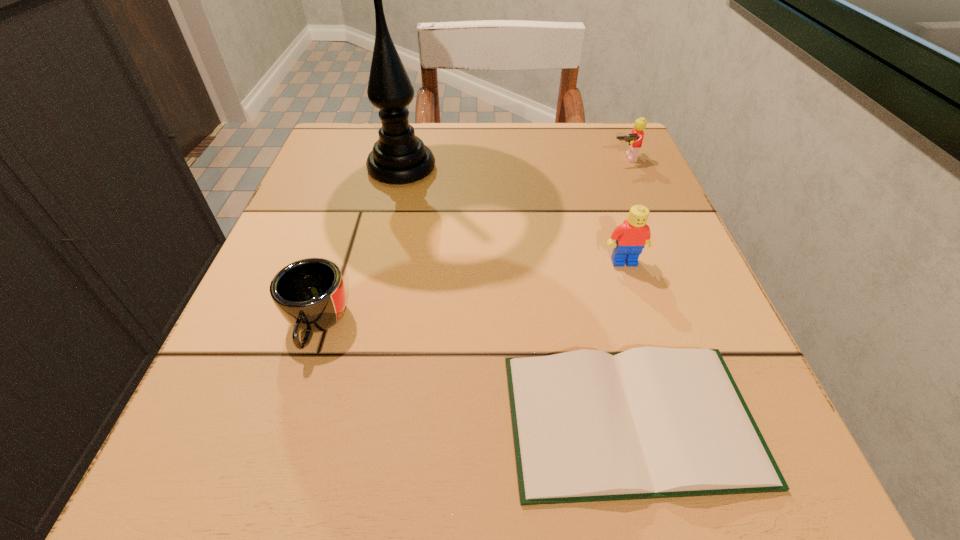
At what (x,y) coordinates should I click in order to perform the action: click on object positioned at the near right corner. Please return your answer as a coordinate pair (x, y). Looking at the image, I should click on (651, 422).

Locate an element on the screen. This screenshot has width=960, height=540. blank area at the far edge is located at coordinates (455, 160).

The height and width of the screenshot is (540, 960). What are the coordinates of `free region at the left edge of the desktop` in the screenshot? It's located at (292, 261).

At what (x,y) coordinates should I click in order to perform the action: click on vacant space at the right edge of the desktop. Please return your answer as a coordinate pair (x, y). Looking at the image, I should click on (576, 198).

You are a GUI agent. You are given a task and a screenshot of the screen. Output one action in this format:
    pyautogui.click(x=<x>, y=<y>)
    Task: Click on the vacant space at the far left corner
    
    Given the screenshot: What is the action you would take?
    pyautogui.click(x=343, y=184)

You are a GUI agent. You are given a task and a screenshot of the screen. Output one action in this format:
    pyautogui.click(x=<x>, y=<y>)
    Task: Click on the vacant space at the near left corner of the desktop
    
    Given the screenshot: What is the action you would take?
    pyautogui.click(x=300, y=500)

In the image, there is a desktop. Where is `vacant region at the far right corner`? vacant region at the far right corner is located at coordinates (565, 132).

The image size is (960, 540). Find the location of `empty space between the shorter Lego and the mug`. empty space between the shorter Lego and the mug is located at coordinates (470, 241).

Locate an element on the screen. vacant area that lies between the hardback book and the tallest object is located at coordinates (516, 294).

Locate an element on the screen. Image resolution: width=960 pixels, height=540 pixels. free space between the fourth tallest object and the lamp is located at coordinates (359, 247).